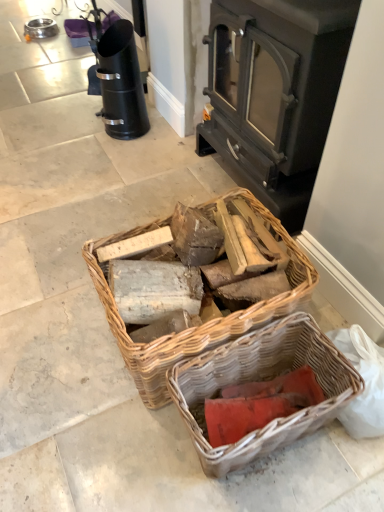
Question: Is rustic wicker basket at lower center, which is the 1th picnic basket in bottom-to-top order, behind woven wood basket at center, the first picnic basket viewed from the top?

Choices:
 (A) yes
 (B) no

Answer: (B)

Question: Considering the relative positions of rustic wicker basket at lower center, which appears as the second picnic basket when viewed from the top, and woven wood basket at center, which ranks as the 2th picnic basket in bottom-to-top order, in the image provided, is rustic wicker basket at lower center, which appears as the second picnic basket when viewed from the top, to the right of woven wood basket at center, which ranks as the 2th picnic basket in bottom-to-top order, from the viewer's perspective?

Choices:
 (A) yes
 (B) no

Answer: (A)

Question: Is rustic wicker basket at lower center, which is the 1th picnic basket in bottom-to-top order, shorter than woven wood basket at center, which ranks as the 2th picnic basket in bottom-to-top order?

Choices:
 (A) yes
 (B) no

Answer: (A)

Question: From the image's perspective, does rustic wicker basket at lower center, which is the 1th picnic basket in bottom-to-top order, appear lower than woven wood basket at center, which ranks as the 2th picnic basket in bottom-to-top order?

Choices:
 (A) yes
 (B) no

Answer: (A)

Question: Does rustic wicker basket at lower center, which is the 1th picnic basket in bottom-to-top order, have a larger size compared to woven wood basket at center, the first picnic basket viewed from the top?

Choices:
 (A) yes
 (B) no

Answer: (B)

Question: Relative to red cardboard at lower center, is dark gray metal wood burning stove at center in front or behind?

Choices:
 (A) front
 (B) behind

Answer: (B)

Question: From their relative heights in the image, would you say dark gray metal wood burning stove at center is taller or shorter than red cardboard at lower center?

Choices:
 (A) tall
 (B) short

Answer: (A)

Question: Is dark gray metal wood burning stove at center situated inside red cardboard at lower center or outside?

Choices:
 (A) inside
 (B) outside

Answer: (B)

Question: From the image's perspective, is dark gray metal wood burning stove at center above or below red cardboard at lower center?

Choices:
 (A) above
 (B) below

Answer: (A)

Question: Considering the positions of dark gray metal wood burning stove at center and woven wood basket at center, the first picnic basket viewed from the top, in the image, is dark gray metal wood burning stove at center taller or shorter than woven wood basket at center, the first picnic basket viewed from the top,?

Choices:
 (A) short
 (B) tall

Answer: (B)

Question: Is dark gray metal wood burning stove at center wider or thinner than woven wood basket at center, which ranks as the 2th picnic basket in bottom-to-top order?

Choices:
 (A) wide
 (B) thin

Answer: (B)

Question: In terms of size, does dark gray metal wood burning stove at center appear bigger or smaller than woven wood basket at center, the first picnic basket viewed from the top?

Choices:
 (A) big
 (B) small

Answer: (A)

Question: Is point (228, 24) closer or farther from the camera than point (193, 348)?

Choices:
 (A) closer
 (B) farther

Answer: (B)

Question: Is red cardboard at lower center in front of or behind woven wood basket at center, which ranks as the 2th picnic basket in bottom-to-top order, in the image?

Choices:
 (A) front
 (B) behind

Answer: (B)

Question: From a real-world perspective, is red cardboard at lower center above or below woven wood basket at center, which ranks as the 2th picnic basket in bottom-to-top order?

Choices:
 (A) above
 (B) below

Answer: (B)